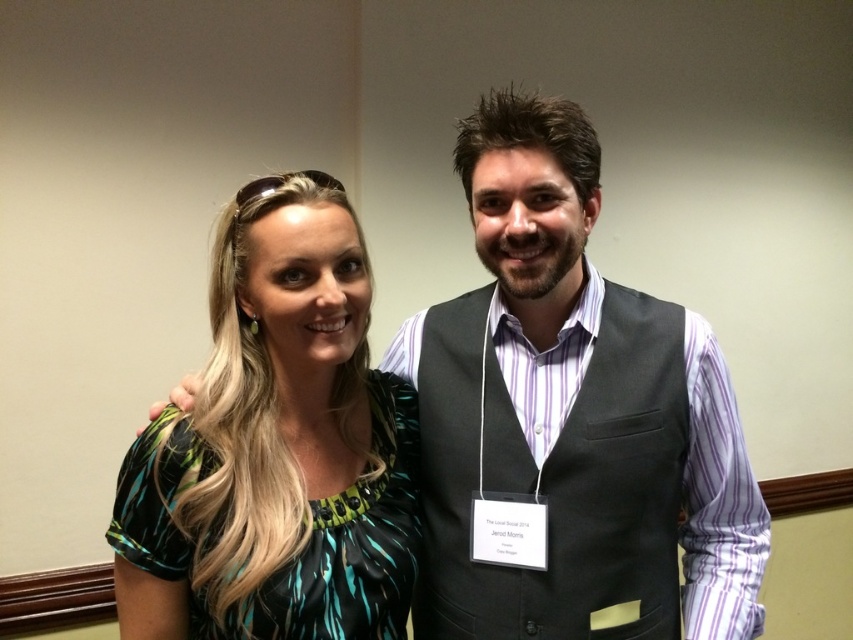
Which is in front, point (462, 328) or point (354, 620)?

Point (354, 620) is more forward.

Which is behind, point (612, 508) or point (325, 596)?

The point (612, 508) is behind.

Identify the location of matte black vest at center. The height and width of the screenshot is (640, 853). (572, 419).